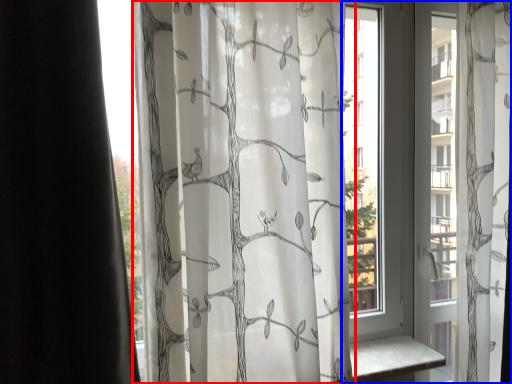
Question: Which object is further to the camera taking this photo, curtain (highlighted by a red box) or window (highlighted by a blue box)?

Choices:
 (A) curtain
 (B) window

Answer: (B)